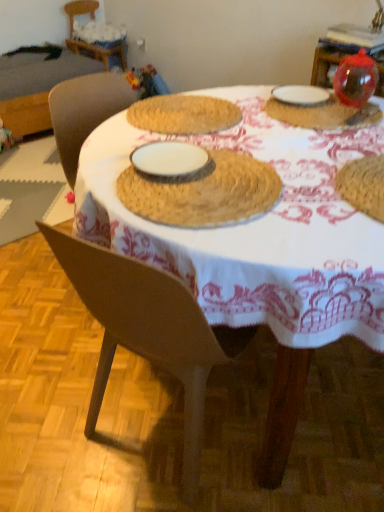
Where is `vacant space situated on the left part of transparent plastic ball at upper right, the second tableware in the left-to-right sequence`? This screenshot has height=512, width=384. vacant space situated on the left part of transparent plastic ball at upper right, the second tableware in the left-to-right sequence is located at coordinates (237, 118).